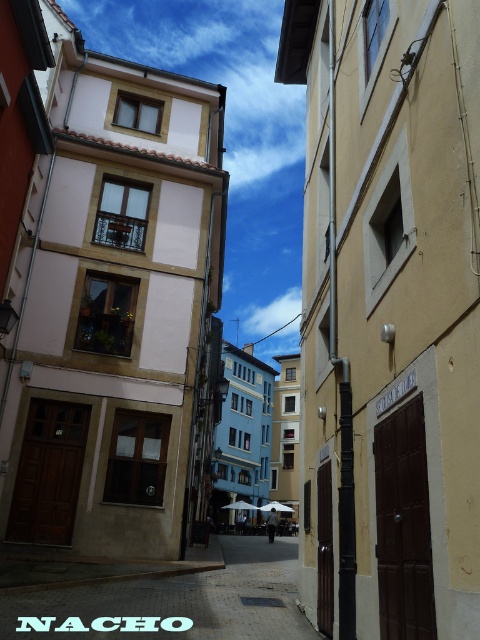
Question: Can you confirm if beige matte door at center right is bigger than smooth stone alley at center?

Choices:
 (A) no
 (B) yes

Answer: (B)

Question: Can you confirm if beige matte door at center right is positioned above smooth stone alley at center?

Choices:
 (A) yes
 (B) no

Answer: (A)

Question: Does beige matte door at center right have a larger size compared to smooth stone alley at center?

Choices:
 (A) no
 (B) yes

Answer: (B)

Question: Which object is closer to the camera taking this photo?

Choices:
 (A) smooth stone alley at center
 (B) beige matte door at center right

Answer: (B)